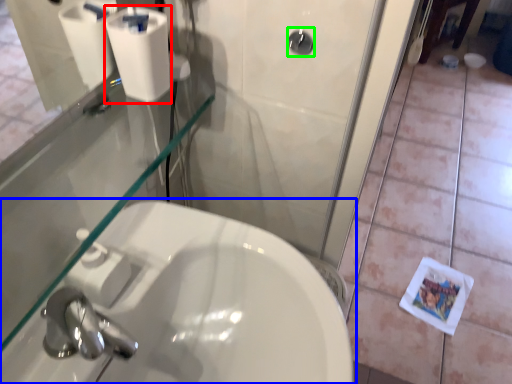
Question: Which is farther away from toilet paper (highlighted by a red box)? sink (highlighted by a blue box) or shower (highlighted by a green box)?

Choices:
 (A) sink
 (B) shower

Answer: (A)